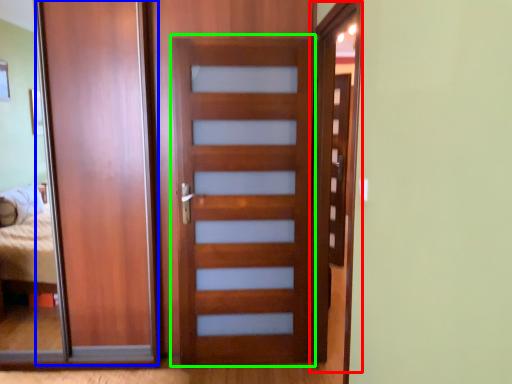
Question: Which object is the closest to the screen door (highlighted by a red box)? Choose among these: barn door (highlighted by a blue box) or screen door (highlighted by a green box).

Choices:
 (A) barn door
 (B) screen door

Answer: (B)